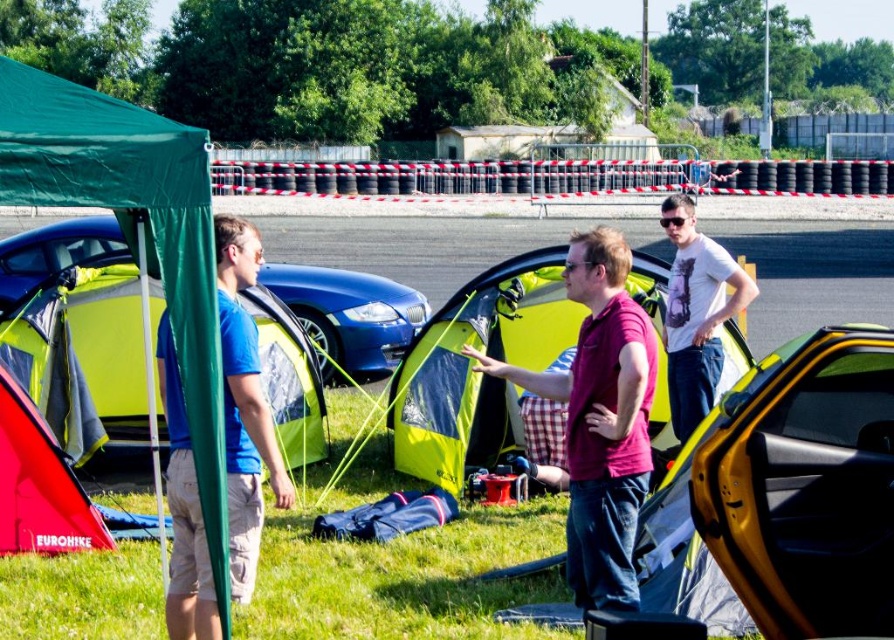
Between yellow metallic car door at right and shiny blue car at center, which one appears on the right side from the viewer's perspective?

yellow metallic car door at right

Locate an element on the screen. This screenshot has width=894, height=640. yellow metallic car door at right is located at coordinates (786, 499).

Based on the photo, which is more to the left, yellow metallic car door at right or glossy blue car at center?

glossy blue car at center

Who is lower down, yellow metallic car door at right or glossy blue car at center?

Positioned lower is yellow metallic car door at right.

Measure the distance between yellow metallic car door at right and camera.

yellow metallic car door at right is 16.74 feet from camera.

Locate an element on the screen. Image resolution: width=894 pixels, height=640 pixels. yellow metallic car door at right is located at coordinates (786, 499).

Does white printed t-shirt at upper right appear under red fabric tent at lower left?

No, white printed t-shirt at upper right is not below red fabric tent at lower left.

You are a GUI agent. You are given a task and a screenshot of the screen. Output one action in this format:
    pyautogui.click(x=<x>, y=<y>)
    Task: Click on the white printed t-shirt at upper right
    
    Given the screenshot: What is the action you would take?
    pyautogui.click(x=696, y=312)

Where is `white printed t-shirt at upper right`? Image resolution: width=894 pixels, height=640 pixels. white printed t-shirt at upper right is located at coordinates (696, 312).